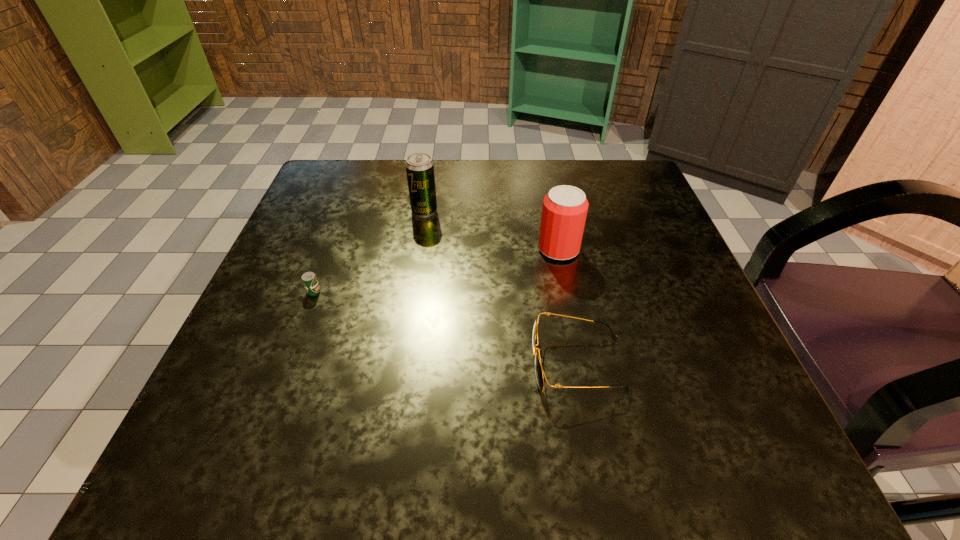
Locate an element on the screen. free space between the shortest object and the second beer can from right to left is located at coordinates (369, 251).

What are the coordinates of `vacant area that lies between the nearest object and the second nearest beer can` in the screenshot? It's located at (568, 306).

This screenshot has width=960, height=540. In order to click on vacant area that lies between the nearest beer can and the second object from left to right in this screenshot , I will do `click(369, 251)`.

Find the location of a particular element. empty space between the sunglasses and the second nearest object is located at coordinates (445, 327).

You are a GUI agent. You are given a task and a screenshot of the screen. Output one action in this format:
    pyautogui.click(x=<x>, y=<y>)
    Task: Click on the object identified as the closest to the leftmost beer can
    
    Given the screenshot: What is the action you would take?
    pyautogui.click(x=419, y=166)

Identify which object is the second nearest to the sunglasses. Please provide its 2D coordinates. Your answer should be formatted as a tuple, i.e. [(x, y)], where the tuple contains the x and y coordinates of a point satisfying the conditions above.

[(419, 166)]

Image resolution: width=960 pixels, height=540 pixels. I want to click on beer can that is the second closest to the rightmost beer can, so click(x=309, y=279).

The height and width of the screenshot is (540, 960). What are the coordinates of `the second closest beer can to the second beer can from right to left` in the screenshot? It's located at (564, 211).